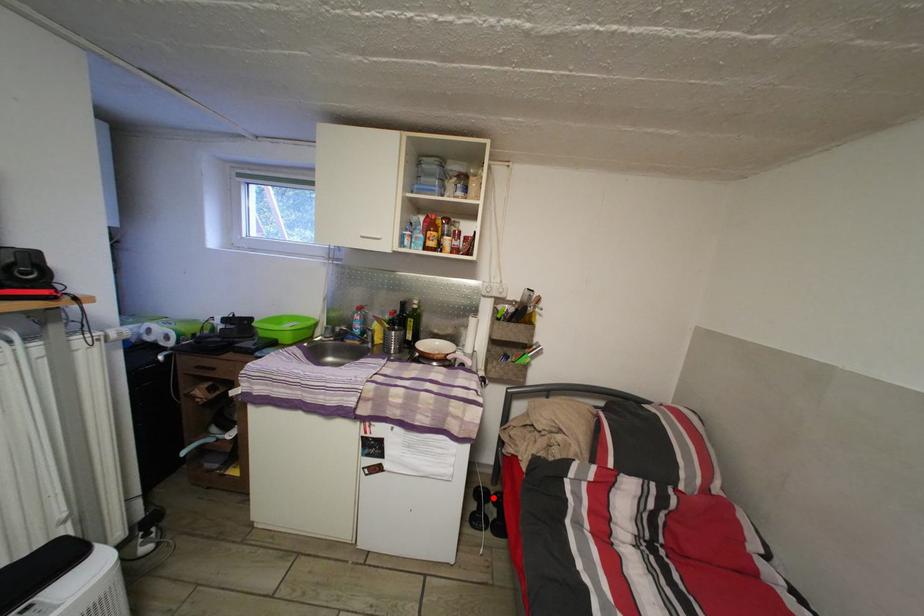
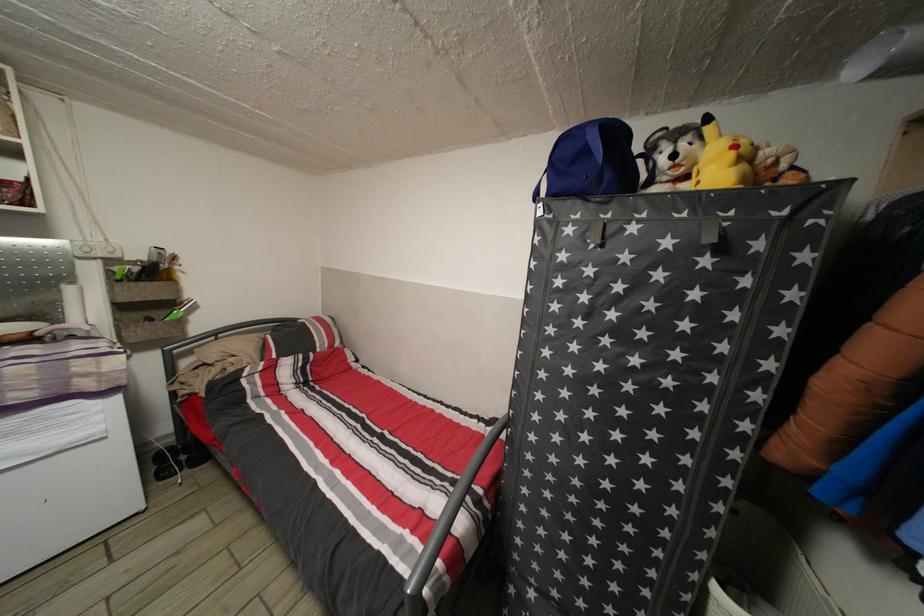
Question: A red point is marked in image1. In image2, is the corresponding 3D point closer to the camera or farther? Reply with the corresponding letter.

Choices:
 (A) The corresponding 3D point is closer.
 (B) The corresponding 3D point is farther.

Answer: (A)